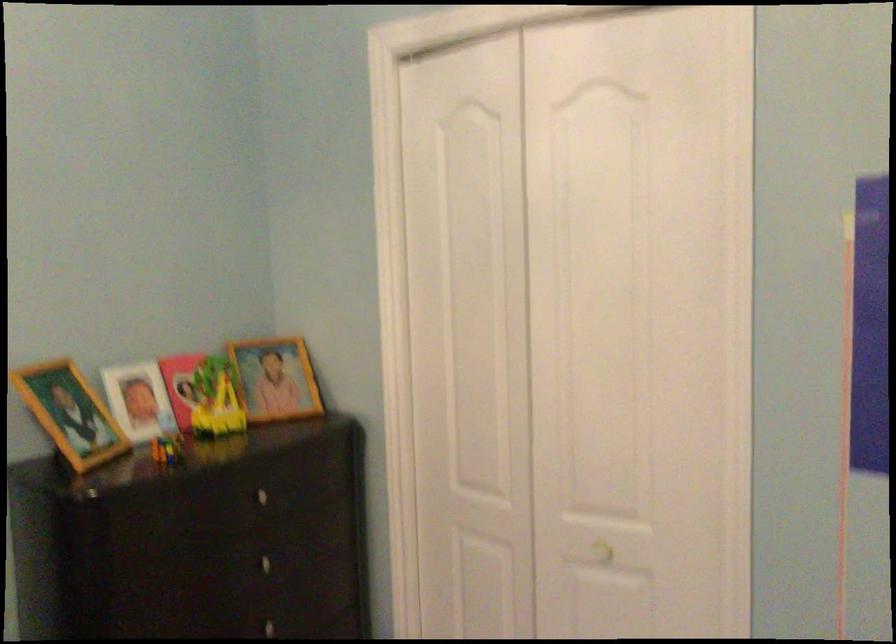
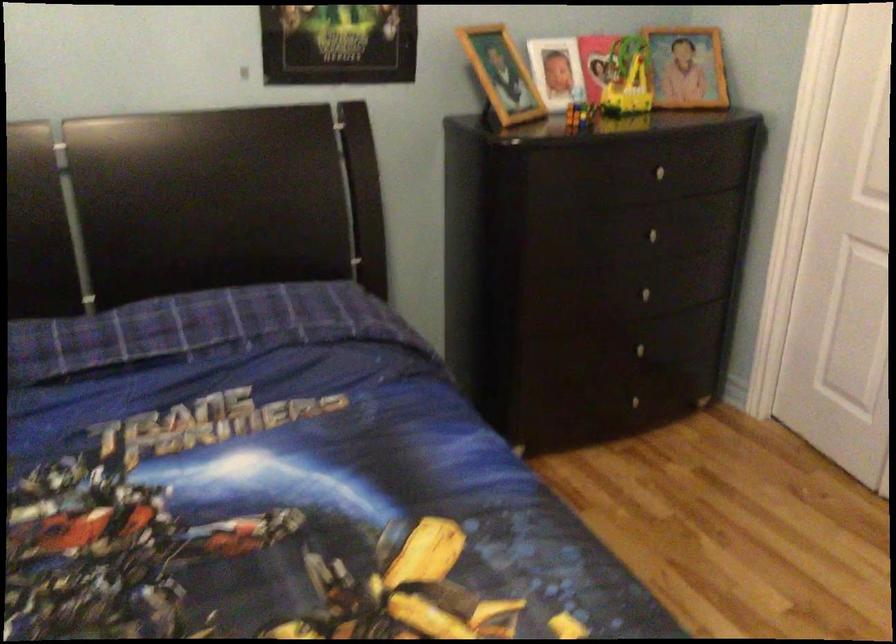
How did the camera likely rotate?

The camera rotated toward left-down.